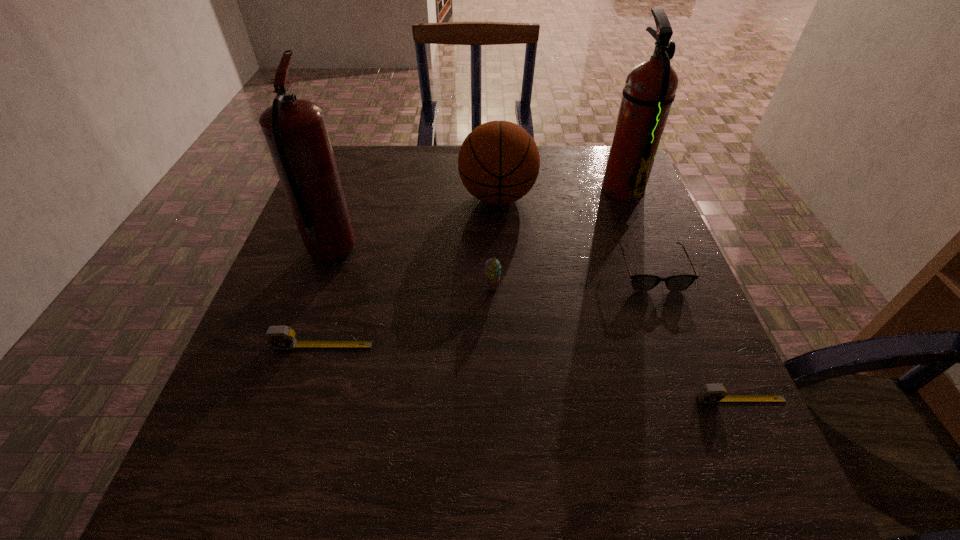
The height and width of the screenshot is (540, 960). Identify the location of the farther tape measure. (279, 337).

Find the location of `the left tape measure`. the left tape measure is located at coordinates (279, 337).

You are a GUI agent. You are given a task and a screenshot of the screen. Output one action in this format:
    pyautogui.click(x=<x>, y=<y>)
    Task: Click on the nearer tape measure
    Image resolution: width=960 pixels, height=540 pixels.
    Given the screenshot: What is the action you would take?
    pyautogui.click(x=710, y=393)

Where is `the shortest object`? This screenshot has width=960, height=540. the shortest object is located at coordinates tap(710, 393).

Identify the location of basketball. (498, 163).

The width and height of the screenshot is (960, 540). Identify the location of the right fire extinguisher. (650, 87).

I want to click on spectacles, so click(x=642, y=282).

Where is `the nearer fire extinguisher`? The width and height of the screenshot is (960, 540). the nearer fire extinguisher is located at coordinates (295, 131).

Find the location of a particular element. The height and width of the screenshot is (540, 960). sherbert is located at coordinates (492, 267).

Find the location of a particular element. free space located at the front of the taller tape measure with the tape extended is located at coordinates (307, 397).